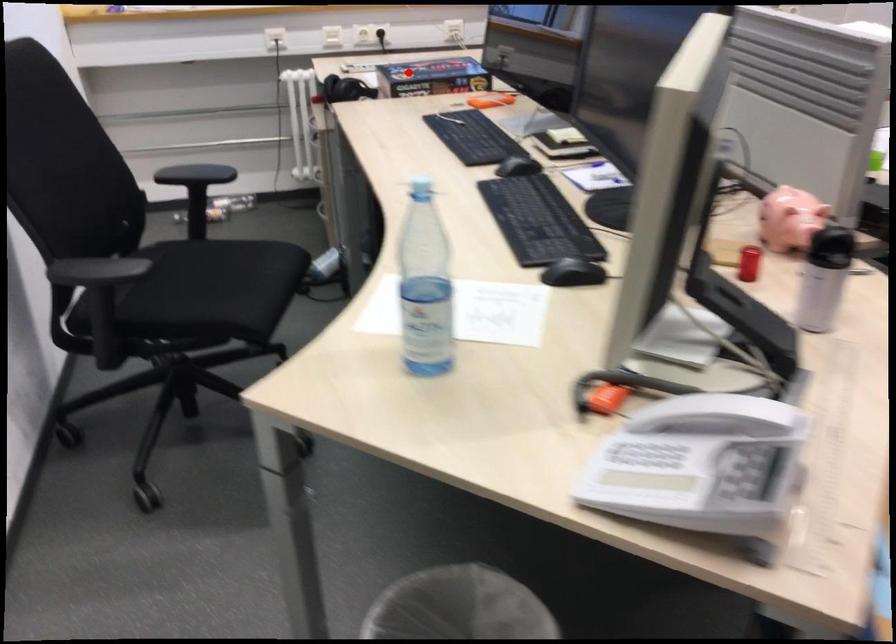
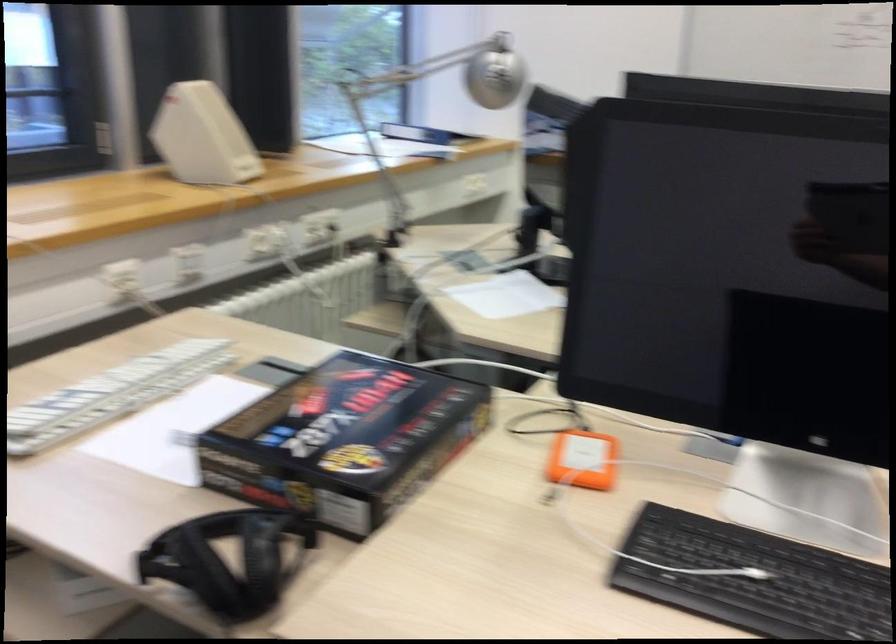
The point at the highlighted location is marked in the first image. Where is the corresponding point in the second image?

(345, 440)